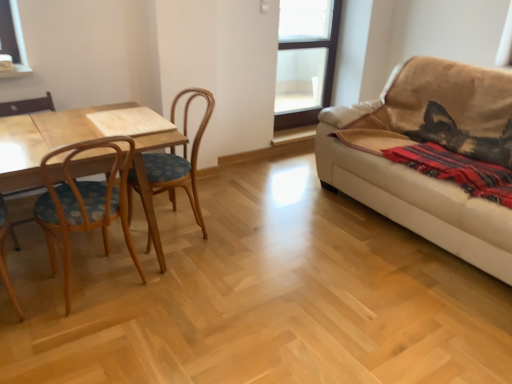
Question: Which is correct: wooden chair at left is inside beige fabric couch at right, or outside of it?

Choices:
 (A) inside
 (B) outside

Answer: (B)

Question: Is wooden chair at left wider or thinner than beige fabric couch at right?

Choices:
 (A) wide
 (B) thin

Answer: (B)

Question: Estimate the real-world distances between objects in this image. Which object is farther from the wooden chair at left?

Choices:
 (A) red woven blanket at right
 (B) wooden table at left
 (C) beige fabric couch at right
 (D) transparent glass window at upper center
 (E) woodenchair at left

Answer: (D)

Question: Estimate the real-world distances between objects in this image. Which object is farther from the woodenchair at left?

Choices:
 (A) beige fabric couch at right
 (B) wooden table at left
 (C) red woven blanket at right
 (D) wooden chair at left
 (E) transparent glass window at upper center

Answer: (E)